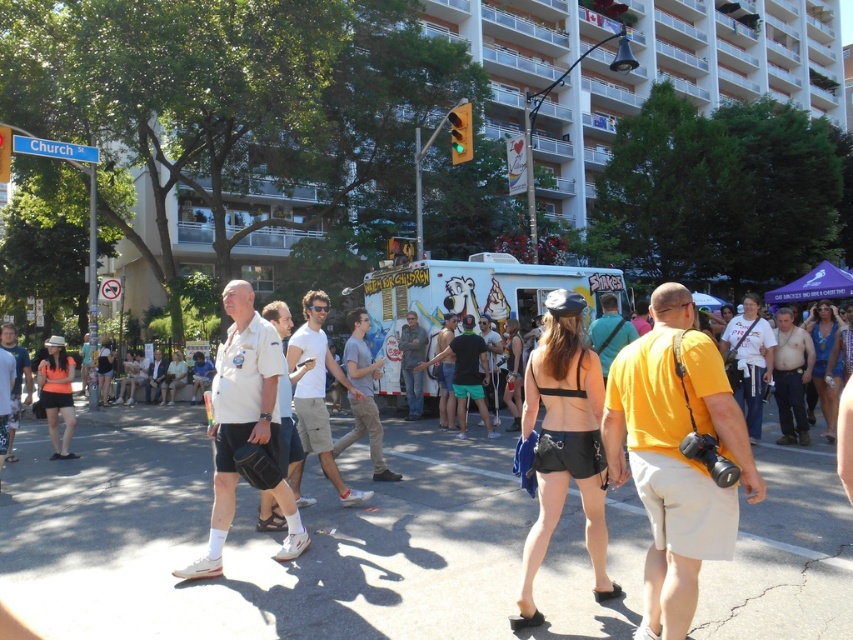
Question: Does white painted ice cream truck at center lie behind green shorts at center?

Choices:
 (A) no
 (B) yes

Answer: (B)

Question: Which point is closer to the camera?

Choices:
 (A) denim jacket at center
 (B) matte white bench at center

Answer: (A)

Question: Estimate the real-world distances between objects in this image. Which object is closer to the light brown cotton shirt at center?

Choices:
 (A) yellow cotton shirt at center
 (B) white painted ice cream truck at center

Answer: (A)

Question: Is white painted ice cream truck at center to the right of white matte shorts at center from the viewer's perspective?

Choices:
 (A) yes
 (B) no

Answer: (A)

Question: Is white painted ice cream truck at center above light brown cotton shirt at center?

Choices:
 (A) no
 (B) yes

Answer: (B)

Question: Estimate the real-world distances between objects in this image. Which object is farther from the black leather shorts at center?

Choices:
 (A) white matte shorts at center
 (B) yellow cotton shirt at center
 (C) matte black shorts at left
 (D) denim jacket at center

Answer: (C)